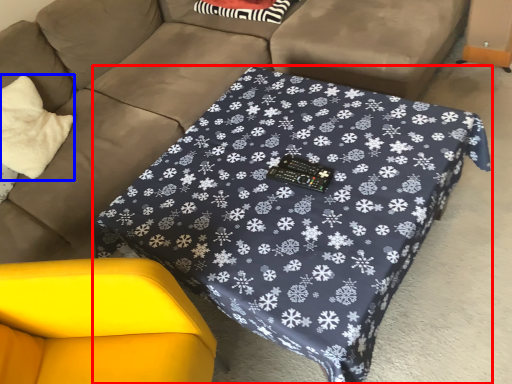
Question: Which of the following is the farthest to the observer, table (highlighted by a red box) or throw pillow (highlighted by a blue box)?

Choices:
 (A) table
 (B) throw pillow

Answer: (B)